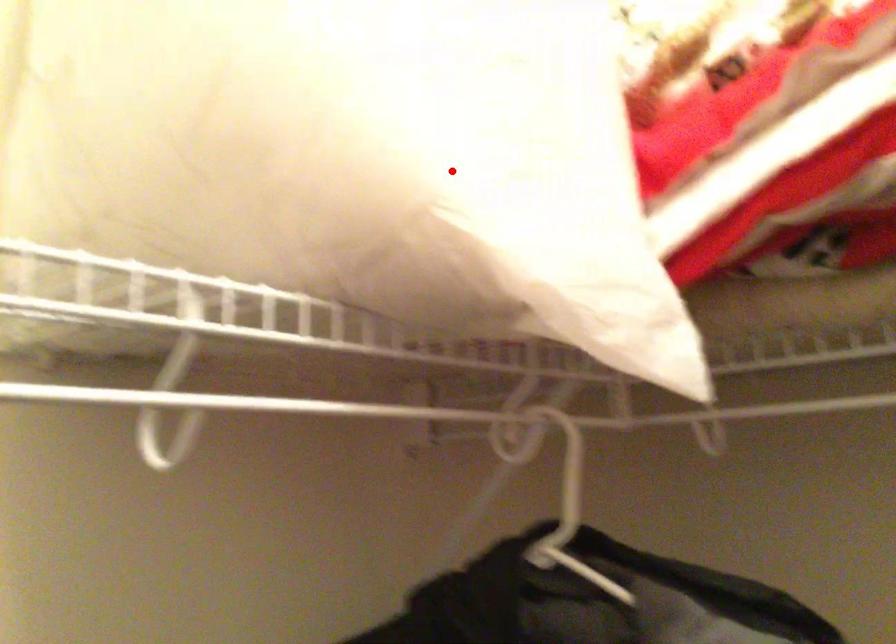
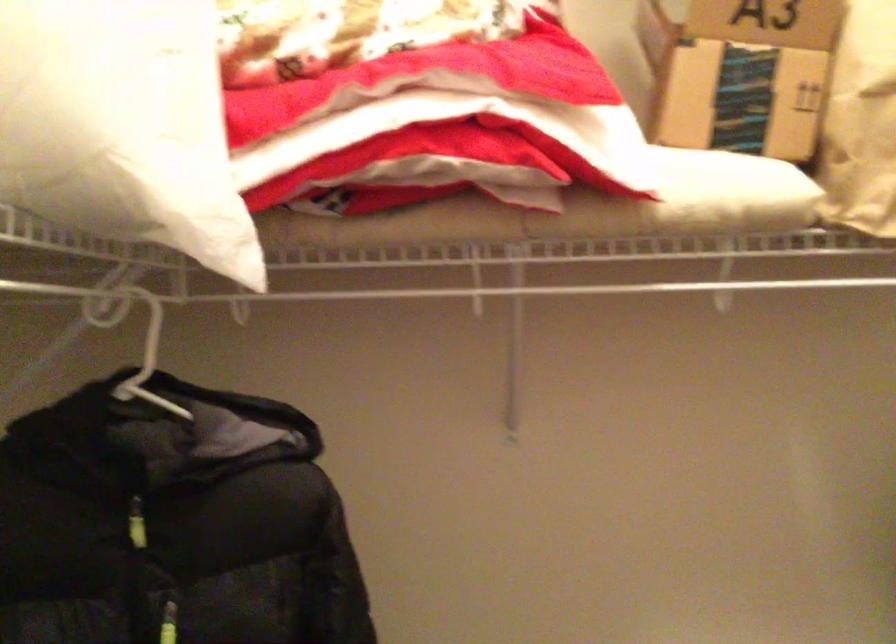
Question: I am providing you with two images of the same scene from different viewpoints. A red point is shown in image1. For the corresponding object point in image2, is it positioned nearer or farther from the camera?

Choices:
 (A) Nearer
 (B) Farther

Answer: (B)